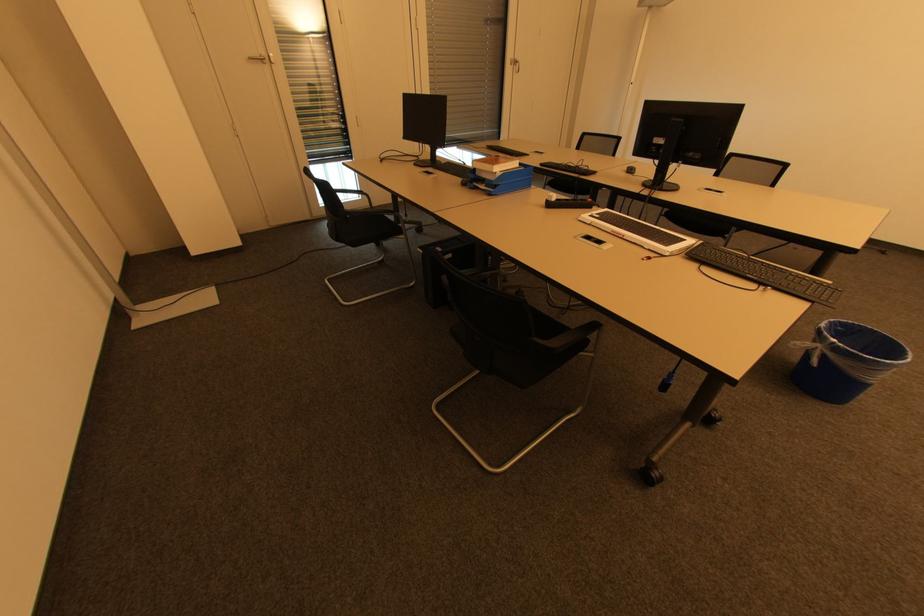
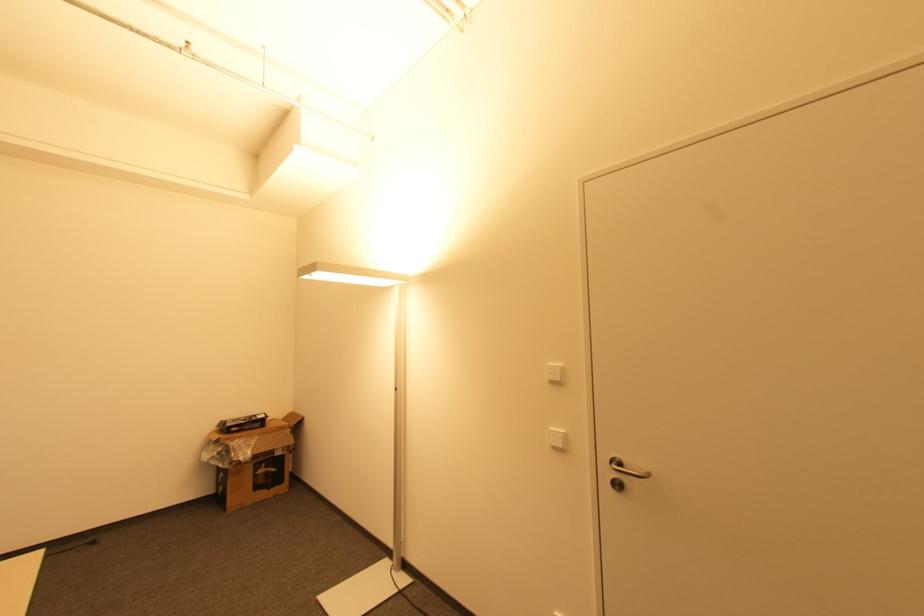
Question: The camera is either moving clockwise (left) or counter-clockwise (right) around the object. The first image is from the beginning of the video and the second image is from the end. Is the camera moving left or right when shooting the video?

Choices:
 (A) Left
 (B) Right

Answer: (A)